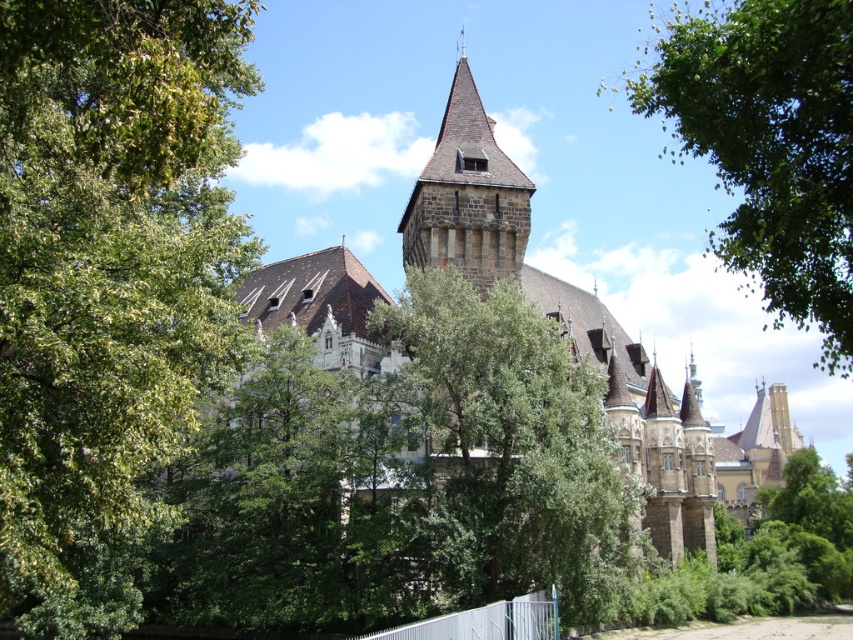
You are standing in front of the historic building and want to take a photo of both the green leafy tree at center and the brown tiled roof at center. Which object should you adjust your camera focus to first to ensure it appears sharp in the photo?

You should focus on the green leafy tree at center first because it is closer to the viewer than the brown tiled roof at center, so adjusting focus starting from the closer object ensures both can be in focus.

You are standing in front of the grand historic building. Where is the green leafy tree at upper left located in the image?

The green leafy tree at upper left is located at point (108, 257) in the image.